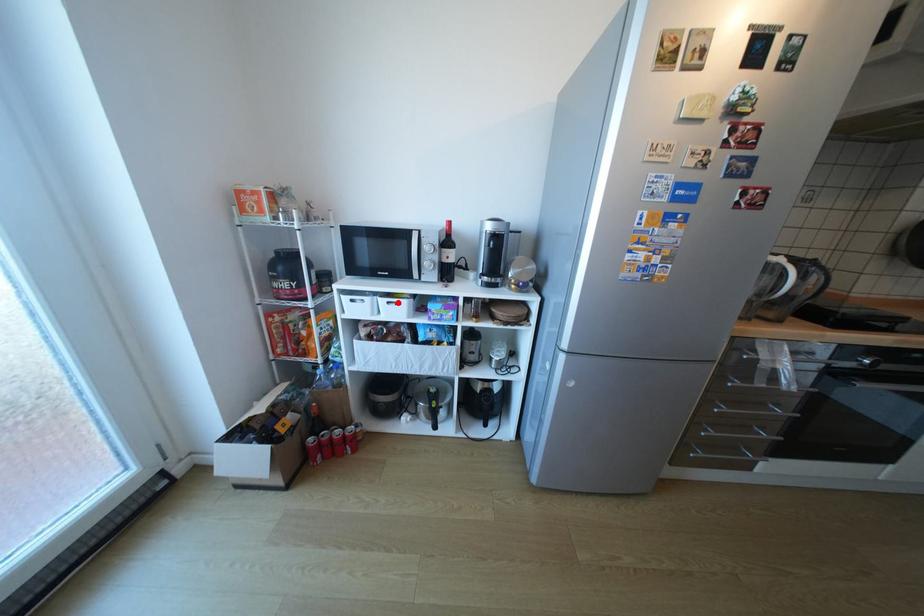
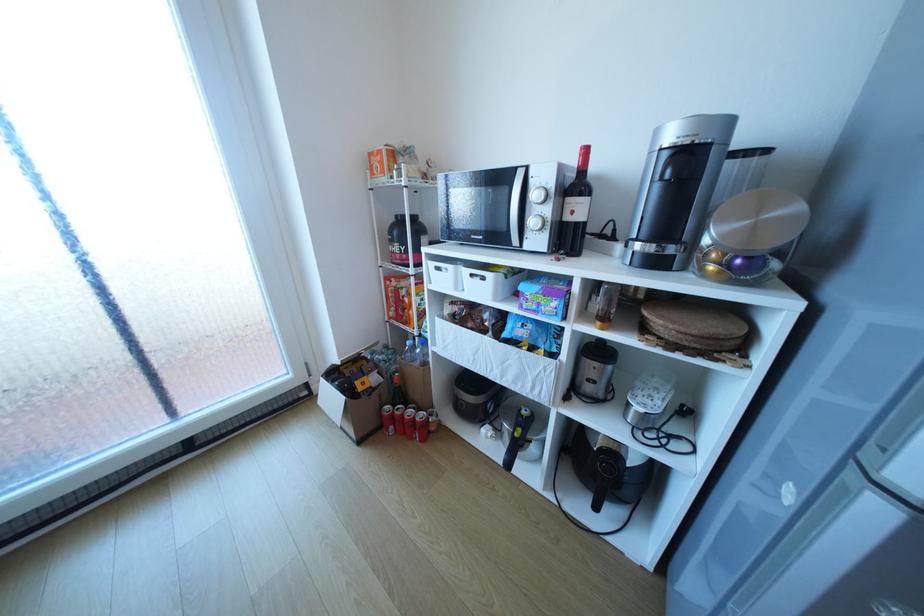
In the second image, find the point that corresponds to the highlighted location in the first image.

(481, 275)